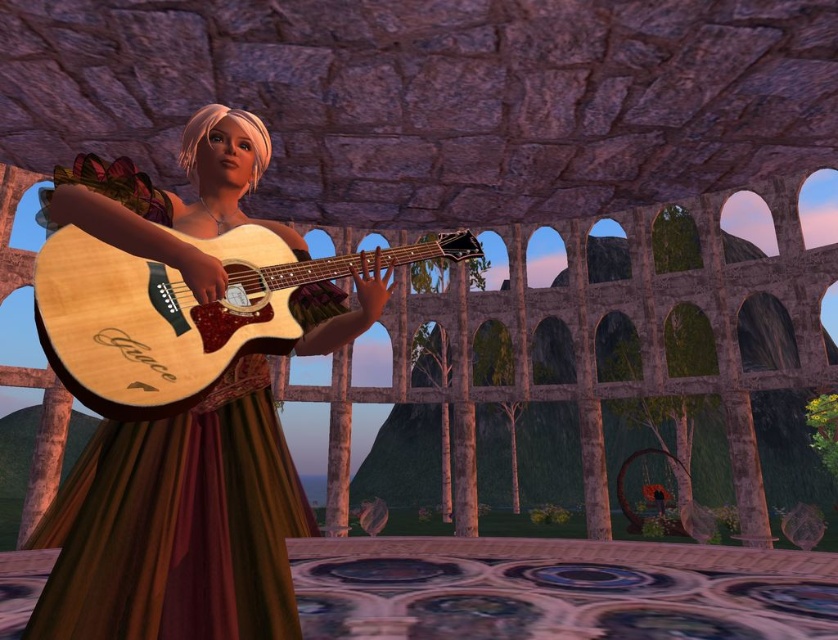
Is wooden guitar at center below natural wood guitar at center?

Yes, wooden guitar at center is below natural wood guitar at center.

Is point (176, 600) in front of point (427, 250)?

Yes, point (176, 600) is in front of point (427, 250).

Measure the distance between wooden guitar at center and camera.

wooden guitar at center is 4.85 feet from camera.

Find the location of a particular element. wooden guitar at center is located at coordinates (178, 525).